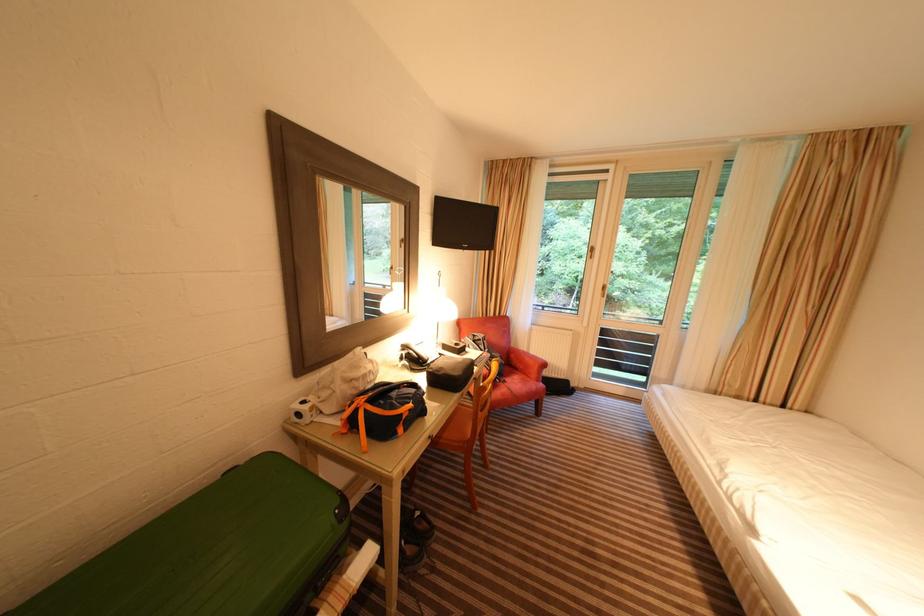
Where would you turn the window lever handle? Please return your answer as a coordinate pair (x, y).

(602, 291)